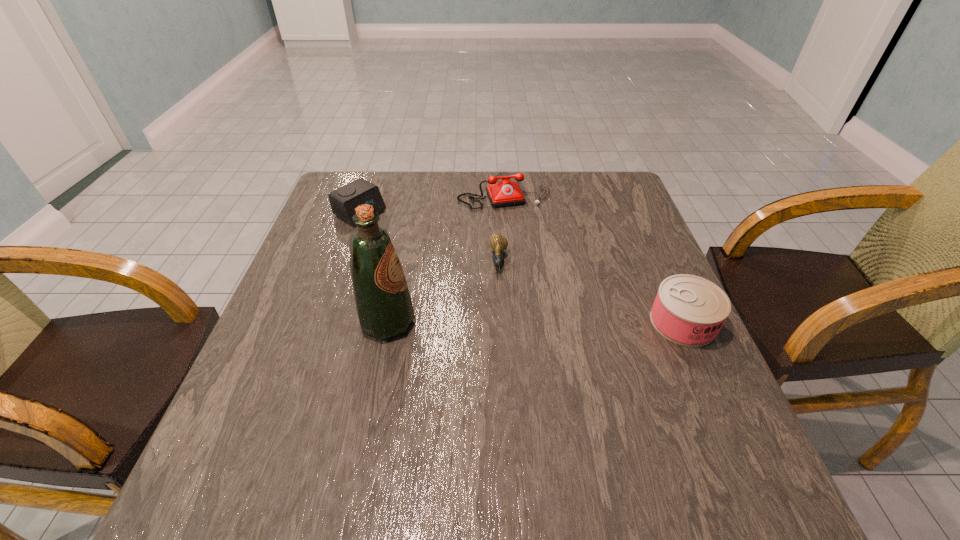
Identify the location of vacant space on the desktop that is between the olive oil and the rightmost object and is positioned on the front-facing side of the leftmost object. (541, 322).

The image size is (960, 540). What are the coordinates of `vacant spot on the desktop that is between the tallest object and the rightmost object and is positioned on the dial of the telephone` in the screenshot? It's located at (561, 322).

This screenshot has width=960, height=540. I want to click on free space on the desktop that is between the olive oil and the can and is positioned on the front-facing side of the shortest object, so click(496, 322).